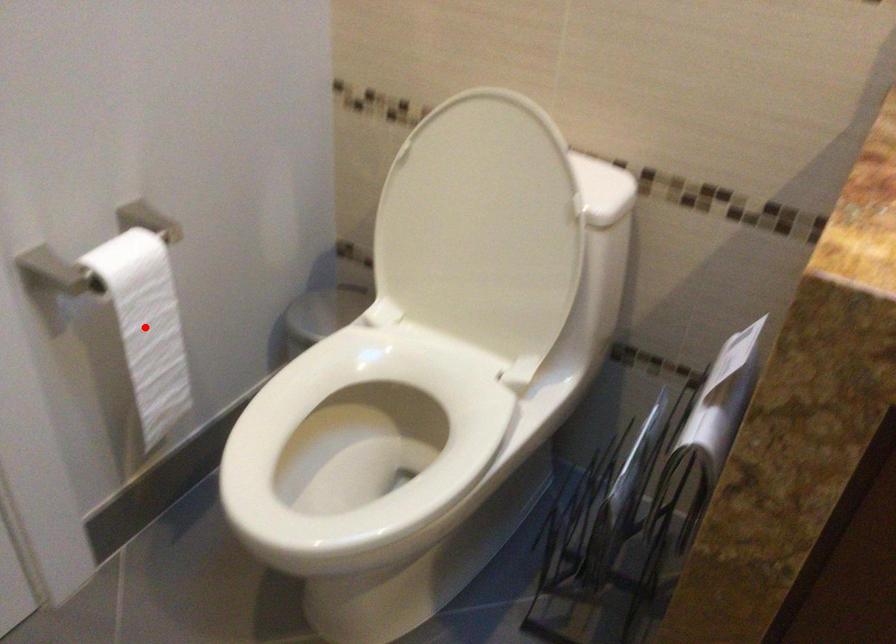
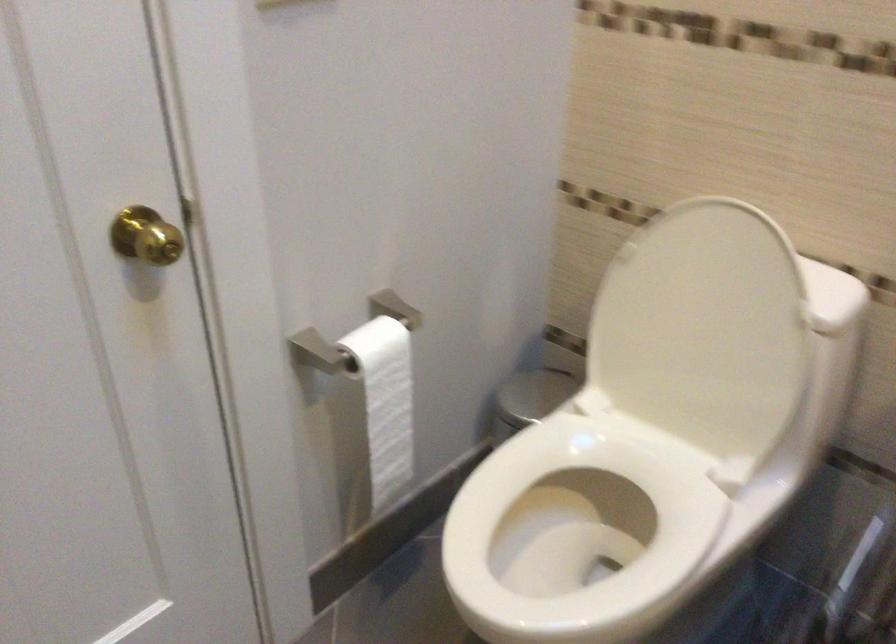
Where in the second image is the point corresponding to the highlighted location from the first image?

(385, 402)